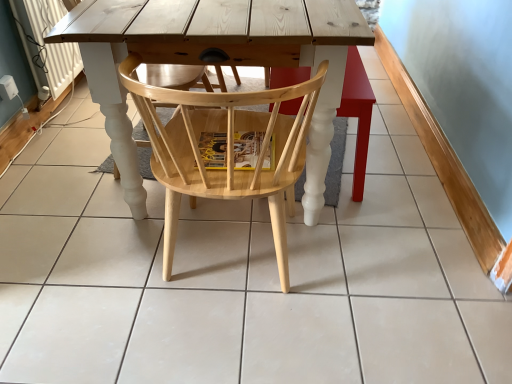
Question: Is wooden chair at center spatially inside natural wood chair at center, or outside of it?

Choices:
 (A) inside
 (B) outside

Answer: (B)

Question: From a real-world perspective, is wooden chair at center positioned above or below natural wood chair at center?

Choices:
 (A) above
 (B) below

Answer: (B)

Question: Is wooden chair at center wider or thinner than natural wood chair at center?

Choices:
 (A) wide
 (B) thin

Answer: (B)

Question: Is point (282, 284) closer or farther from the camera than point (352, 51)?

Choices:
 (A) closer
 (B) farther

Answer: (B)

Question: Is natural wood chair at center bigger or smaller than wooden chair at center?

Choices:
 (A) small
 (B) big

Answer: (B)

Question: Relative to wooden chair at center, is natural wood chair at center in front or behind?

Choices:
 (A) behind
 (B) front

Answer: (B)

Question: Considering the relative positions of natural wood chair at center and wooden chair at center in the image provided, is natural wood chair at center to the left or to the right of wooden chair at center?

Choices:
 (A) right
 (B) left

Answer: (B)